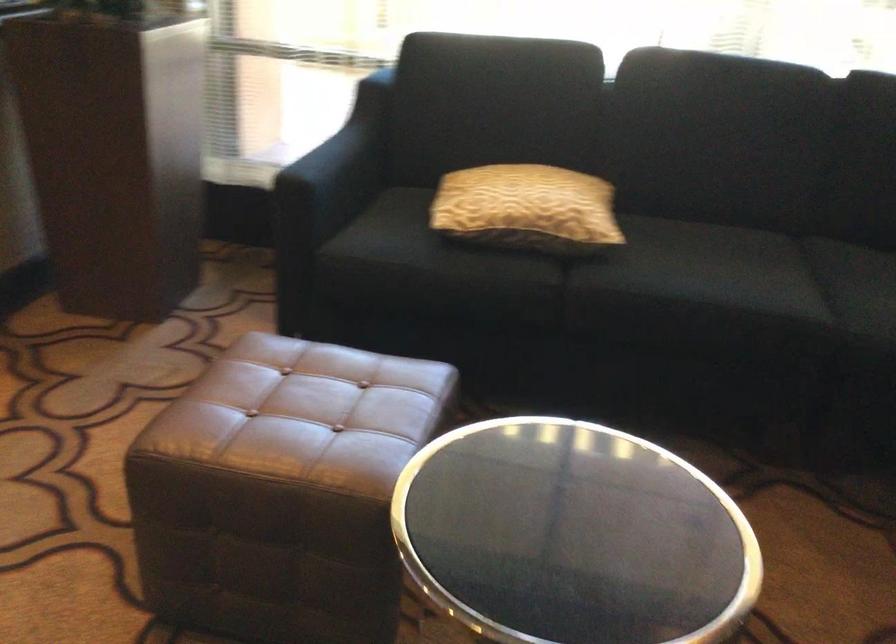
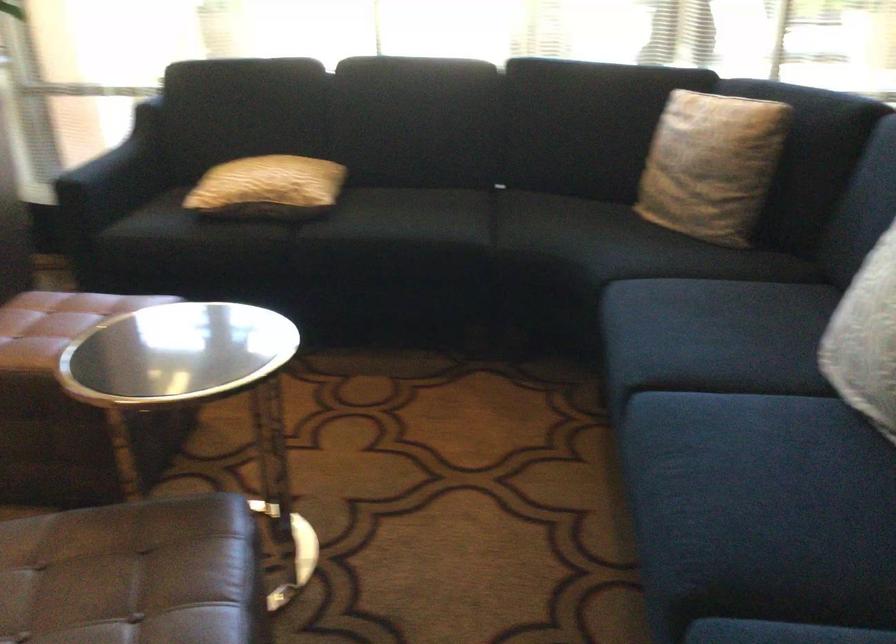
Question: The first image is from the beginning of the video and the second image is from the end. How did the camera likely rotate when shooting the video?

Choices:
 (A) Left
 (B) Right
 (C) Up
 (D) Down

Answer: (B)